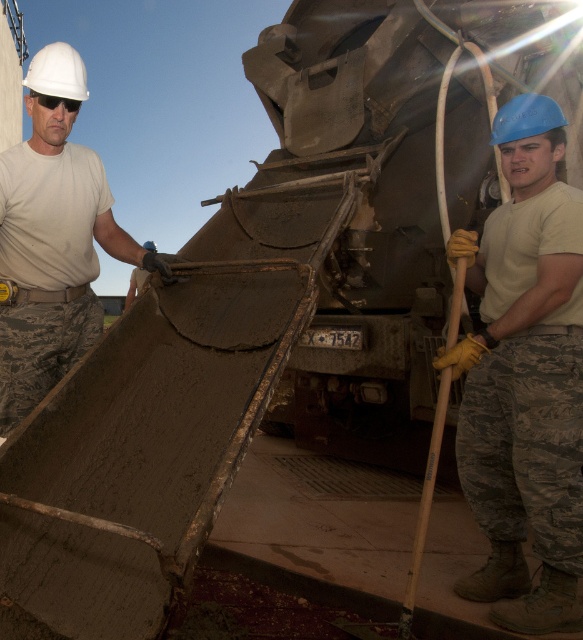
You are a safety inspector at the construction site. You need to ensure that all workers are wearing their hard hats properly. The blue hard hat at upper right and matte white helmet at upper left are both being worn by workers. Which one is higher?

The blue hard hat at upper right has a greater height compared to the matte white helmet at upper left, so the blue hard hat at upper right is higher.

Based on the photo, you are standing at the camera position and want to reach the point marked at coordinates (535, 490). If you take a step forward of 1 meter, will you be closer to the point?

The point at coordinates (535, 490) is 2.41 meters from the camera. After stepping forward 1 meter, you would be 1.41 meters away, which is closer.